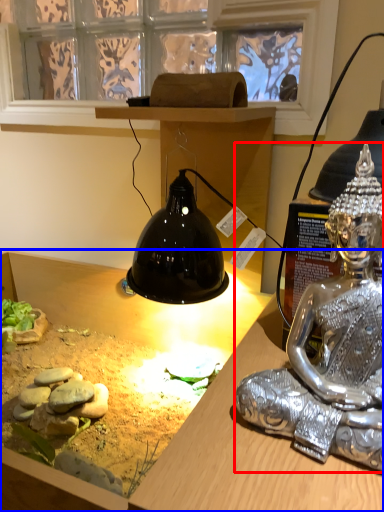
Question: Which object appears closest to the camera in this image, person (highlighted by a red box) or desk (highlighted by a blue box)?

Choices:
 (A) person
 (B) desk

Answer: (B)